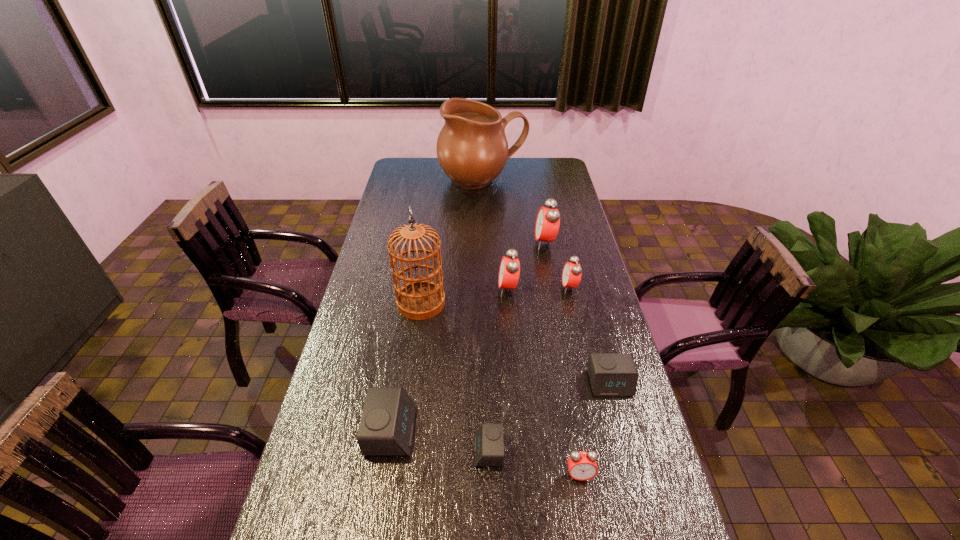
Image resolution: width=960 pixels, height=540 pixels. Identify the location of vacant space located on the front-facing side of the seventh shortest object. (461, 243).

I want to click on vacant region located on the front-facing side of the second tallest alarm clock, so click(x=429, y=289).

The image size is (960, 540). In order to click on free space located on the front-facing side of the second tallest alarm clock in this screenshot , I will do `click(398, 289)`.

This screenshot has width=960, height=540. Identify the location of vacant area situated on the front-facing side of the second tallest alarm clock. [x=437, y=289].

This screenshot has width=960, height=540. Identify the location of free space located 0.360m on the front-facing side of the third biggest red alarm clock. click(462, 287).

In order to click on free location located 0.160m on the front-facing side of the third biggest red alarm clock in this screenshot , I will do `click(517, 287)`.

Where is `vacant space located on the front-facing side of the third biggest red alarm clock`? vacant space located on the front-facing side of the third biggest red alarm clock is located at coordinates (495, 287).

Where is `blank space located 0.220m on the front-facing side of the leftmost black alarm clock`? The height and width of the screenshot is (540, 960). blank space located 0.220m on the front-facing side of the leftmost black alarm clock is located at coordinates (497, 431).

Identify the location of vacant space situated 0.100m on the front-facing side of the second smallest black alarm clock. (622, 430).

Identify the location of vacant space positioned 0.300m on the front-facing side of the shortest alarm clock. (357, 450).